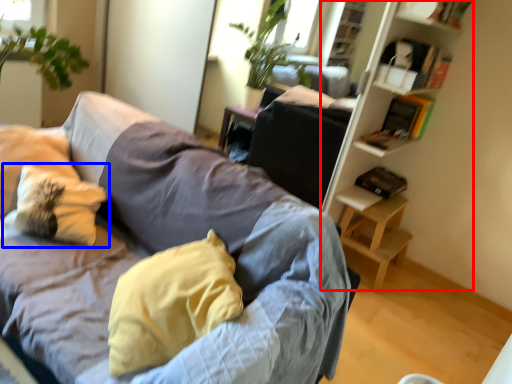
Question: Which object is further to the camera taking this photo, bookshelf (highlighted by a red box) or pillow (highlighted by a blue box)?

Choices:
 (A) bookshelf
 (B) pillow

Answer: (A)